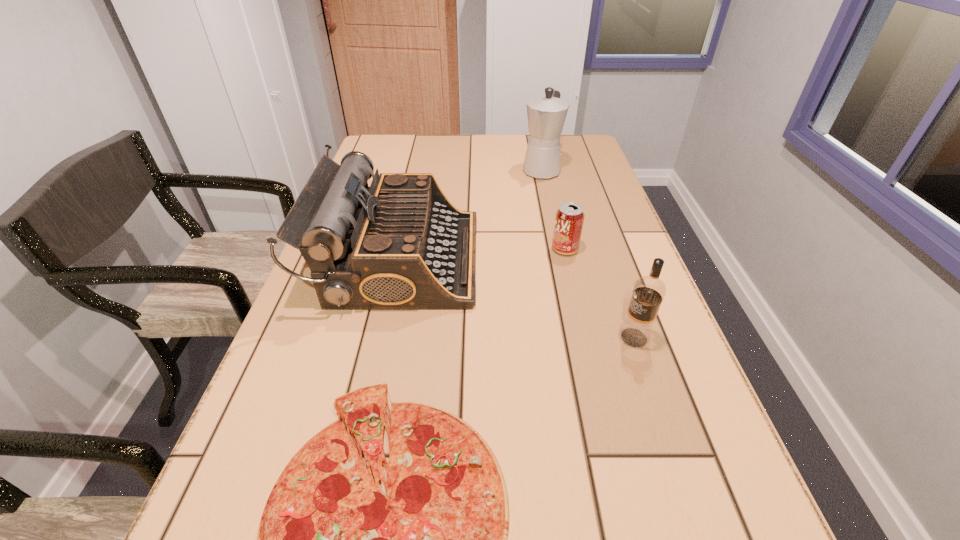
You are a GUI agent. You are given a task and a screenshot of the screen. Output one action in this format:
    pyautogui.click(x=<x>, y=<y>)
    Task: Click on the free space located 0.390m on the label of the fourth farthest object
    The image size is (960, 540).
    Given the screenshot: What is the action you would take?
    pyautogui.click(x=420, y=338)

What are the coordinates of `blank space located 0.060m on the back of the fourth tallest object` in the screenshot? It's located at tap(560, 227).

Locate an element on the screen. This screenshot has width=960, height=540. object present at the far edge is located at coordinates (546, 115).

I want to click on object positioned at the left edge, so click(400, 244).

This screenshot has height=540, width=960. I want to click on coffeepot present at the right edge, so pyautogui.click(x=546, y=115).

Where is `vodka located at the right edge`? vodka located at the right edge is located at coordinates (649, 291).

Where is `soda can situated at the right edge`? Image resolution: width=960 pixels, height=540 pixels. soda can situated at the right edge is located at coordinates (569, 219).

The height and width of the screenshot is (540, 960). Identify the location of object that is at the far right corner. (546, 115).

Locate an element on the screen. The image size is (960, 540). free space at the left edge of the desktop is located at coordinates (347, 323).

The image size is (960, 540). What are the coordinates of `vacant region at the right edge` in the screenshot? It's located at pyautogui.click(x=681, y=445).